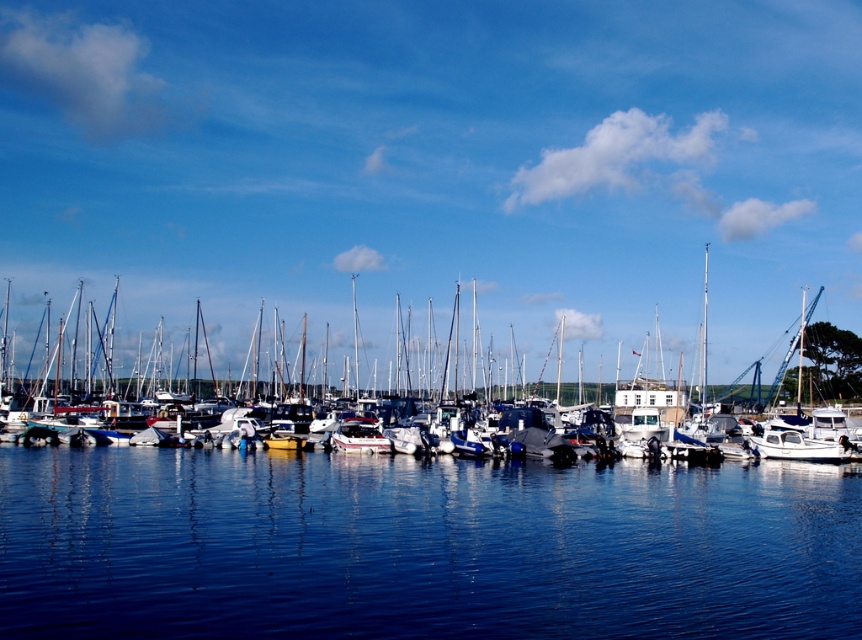
Image resolution: width=862 pixels, height=640 pixels. In order to click on white matte boat at center in this screenshot , I will do `click(434, 241)`.

Describe the element at coordinates (434, 241) in the screenshot. I see `white matte boat at center` at that location.

Identify the location of white matte boat at center. The image size is (862, 640). (434, 241).

Locate an element on the screen. The image size is (862, 640). white matte boat at center is located at coordinates (434, 241).